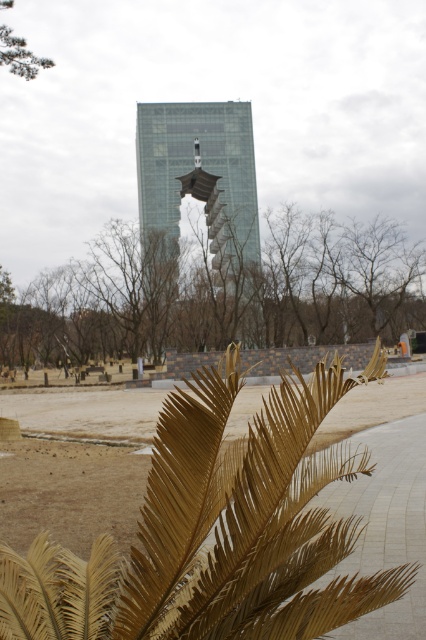
You are a photographer standing in the urban landscape scene. You want to capture a photo where the gold textured palm leaf at lower center is clearly visible without being blocked by the green leafy tree at upper left. Is this possible based on their positions?

Yes, the gold textured palm leaf at lower center is in front of the green leafy tree at upper left, so it will be visible and not blocked by the tree.